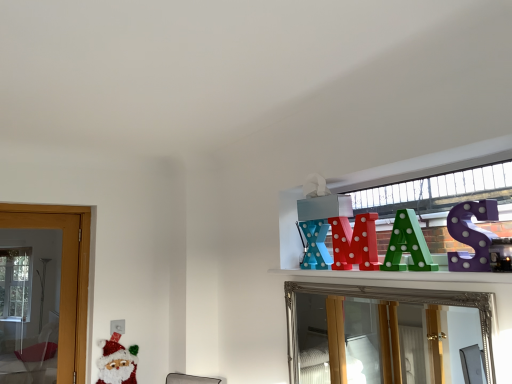
At what (x,y) coordinates should I click in order to perform the action: click on matte plastic letter x at upper center, which is counted as the 4th toy, starting from the front. Please return your answer as a coordinate pair (x, y). The image size is (512, 384). Looking at the image, I should click on (315, 245).

What is the approximate width of green polka dot letter a at upper center, which ranks as the third toy in left-to-right order?

green polka dot letter a at upper center, which ranks as the third toy in left-to-right order, is 2.84 inches in width.

Find the location of a particular element. This screenshot has height=384, width=512. green polka dot letter a at upper center, which is the 3th toy in back-to-front order is located at coordinates (407, 245).

Where is `shiny red letter at upper center, arranged as the 3th toy when viewed from the front`? shiny red letter at upper center, arranged as the 3th toy when viewed from the front is located at coordinates (355, 242).

From the image's perspective, which is above, matte plastic letter x at upper center, which is counted as the 4th toy, starting from the front, or shiny red letter at upper center, which is the 2th toy from back to front?

shiny red letter at upper center, which is the 2th toy from back to front, is shown above in the image.

Which is closer, (316, 226) or (351, 230)?

Point (316, 226) appears to be farther away from the viewer than point (351, 230).

Which of these two, matte plastic letter x at upper center, which is counted as the 4th toy, starting from the front, or shiny red letter at upper center, which is the 2th toy from back to front, is smaller?

Smaller between the two is matte plastic letter x at upper center, which is counted as the 4th toy, starting from the front.

Is matte plastic letter x at upper center, marked as the 1th toy in a left-to-right arrangement, to the left or to the right of shiny red letter at upper center, which is the 2th toy from back to front, in the image?

Clearly, matte plastic letter x at upper center, marked as the 1th toy in a left-to-right arrangement, is on the left of shiny red letter at upper center, which is the 2th toy from back to front, in the image.

How different are the orientations of purple polka dot letter at upper right, which appears as the 1th toy when viewed from the front, and green polka dot letter a at upper center, which ranks as the third toy in left-to-right order, in degrees?

They differ by 3.57 degrees in their facing directions.

From the image's perspective, which is above, purple polka dot letter at upper right, which appears as the 1th toy when viewed from the front, or green polka dot letter a at upper center, which ranks as the third toy in left-to-right order?

purple polka dot letter at upper right, which appears as the 1th toy when viewed from the front, appears higher in the image.

Is purple polka dot letter at upper right, arranged as the 4th toy when viewed from the back, positioned with its back to green polka dot letter a at upper center, which is the 3th toy in back-to-front order?

No, purple polka dot letter at upper right, arranged as the 4th toy when viewed from the back, is not facing away from green polka dot letter a at upper center, which is the 3th toy in back-to-front order.

Would you say purple polka dot letter at upper right, the first toy from the right, is outside green polka dot letter a at upper center, which is the 3th toy in back-to-front order?

Yes.

Are green polka dot letter a at upper center, arranged as the second toy when viewed from the right, and silver/glass mirror at upper center making contact?

→ No.

Is green polka dot letter a at upper center, arranged as the second toy when viewed from the right, spatially inside silver/glass mirror at upper center, or outside of it?

The correct answer is: outside.

Is green polka dot letter a at upper center, which is the 3th toy in back-to-front order, facing away from silver/glass mirror at upper center?

No.

From the image's perspective, which one is positioned lower, green polka dot letter a at upper center, arranged as the second toy when viewed from the right, or silver/glass mirror at upper center?

From the image's view, silver/glass mirror at upper center is below.

Does shiny red letter at upper center, arranged as the third toy when viewed from the right, have a smaller size compared to silver/glass mirror at upper center?

Indeed, shiny red letter at upper center, arranged as the third toy when viewed from the right, has a smaller size compared to silver/glass mirror at upper center.

Are shiny red letter at upper center, arranged as the third toy when viewed from the right, and silver/glass mirror at upper center beside each other?

shiny red letter at upper center, arranged as the third toy when viewed from the right, and silver/glass mirror at upper center are clearly separated.

Considering the relative sizes of green polka dot letter a at upper center, the 2th toy when ordered from front to back, and felt santa claus at lower left in the image provided, is green polka dot letter a at upper center, the 2th toy when ordered from front to back, taller than felt santa claus at lower left?

Incorrect, the height of green polka dot letter a at upper center, the 2th toy when ordered from front to back, is not larger of that of felt santa claus at lower left.

Who is bigger, green polka dot letter a at upper center, which is the 3th toy in back-to-front order, or felt santa claus at lower left?

felt santa claus at lower left.

Where is `santa claus on the left of green polka dot letter a at upper center, which ranks as the third toy in left-to-right order`? The width and height of the screenshot is (512, 384). santa claus on the left of green polka dot letter a at upper center, which ranks as the third toy in left-to-right order is located at coordinates (117, 362).

Is point (406, 209) behind point (128, 355)?

That is False.

Where is `the 4th toy located above the felt santa claus at lower left (from a real-world perspective)`? This screenshot has height=384, width=512. the 4th toy located above the felt santa claus at lower left (from a real-world perspective) is located at coordinates (315, 245).

Could you tell me if matte plastic letter x at upper center, which ranks as the 4th toy in right-to-left order, is turned towards felt santa claus at lower left?

No, matte plastic letter x at upper center, which ranks as the 4th toy in right-to-left order, is not oriented towards felt santa claus at lower left.

What's the angular difference between matte plastic letter x at upper center, which is counted as the 4th toy, starting from the front, and felt santa claus at lower left's facing directions?

There is a 90.8-degree angle between the facing directions of matte plastic letter x at upper center, which is counted as the 4th toy, starting from the front, and felt santa claus at lower left.

Consider the image. From a real-world perspective, which is physically above, felt santa claus at lower left or green polka dot letter a at upper center, arranged as the second toy when viewed from the right?

From a 3D spatial view, green polka dot letter a at upper center, arranged as the second toy when viewed from the right, is above.

At what (x,y) coordinates should I click in order to perform the action: click on the 3rd toy counting from the right side of the felt santa claus at lower left. Please return your answer as a coordinate pair (x, y). Image resolution: width=512 pixels, height=384 pixels. Looking at the image, I should click on (x=407, y=245).

Is felt santa claus at lower left completely or partially outside of green polka dot letter a at upper center, which ranks as the third toy in left-to-right order?

Yes.

Identify the location of the 1st toy positioned above the matte plastic letter x at upper center, which is the first toy in back-to-front order (from the image's perspective). (355, 242).

From the purple polka dot letter at upper right, which appears as the 1th toy when viewed from the front, count 1st toys backward and point to it. Please provide its 2D coordinates.

[(407, 245)]

Considering their positions, is felt santa claus at lower left positioned further to green polka dot letter a at upper center, arranged as the second toy when viewed from the right, than matte plastic letter x at upper center, which ranks as the 4th toy in right-to-left order?

felt santa claus at lower left is positioned further to the anchor green polka dot letter a at upper center, arranged as the second toy when viewed from the right.

Looking at the image, which one is located closer to purple polka dot letter at upper right, which appears as the 1th toy when viewed from the front, matte plastic letter x at upper center, which is the first toy in back-to-front order, or silver/glass mirror at upper center?

silver/glass mirror at upper center is positioned closer to the anchor purple polka dot letter at upper right, which appears as the 1th toy when viewed from the front.

When comparing their distances from green polka dot letter a at upper center, which ranks as the third toy in left-to-right order, does shiny red letter at upper center, which is the 2th toy from back to front, or purple polka dot letter at upper right, the first toy from the right, seem further?

The object further to green polka dot letter a at upper center, which ranks as the third toy in left-to-right order, is purple polka dot letter at upper right, the first toy from the right.

When comparing their distances from matte plastic letter x at upper center, which is the first toy in back-to-front order, does shiny red letter at upper center, arranged as the third toy when viewed from the right, or silver/glass mirror at upper center seem further?

silver/glass mirror at upper center is further to matte plastic letter x at upper center, which is the first toy in back-to-front order.

Which object lies nearer to the anchor point silver/glass mirror at upper center, green polka dot letter a at upper center, the 2th toy when ordered from front to back, or matte plastic letter x at upper center, marked as the 1th toy in a left-to-right arrangement?

green polka dot letter a at upper center, the 2th toy when ordered from front to back, is closer to silver/glass mirror at upper center.

Looking at this image, when comparing their distances from silver/glass mirror at upper center, does shiny red letter at upper center, arranged as the 3th toy when viewed from the front, or felt santa claus at lower left seem closer?

shiny red letter at upper center, arranged as the 3th toy when viewed from the front, is positioned closer to the anchor silver/glass mirror at upper center.

Looking at the image, which one is located closer to silver/glass mirror at upper center, shiny red letter at upper center, which is counted as the second toy, starting from the left, or matte plastic letter x at upper center, which is counted as the 4th toy, starting from the front?

shiny red letter at upper center, which is counted as the second toy, starting from the left, lies closer to silver/glass mirror at upper center than the other object.

Considering their positions, is silver/glass mirror at upper center positioned closer to shiny red letter at upper center, which is the 2th toy from back to front, than felt santa claus at lower left?

silver/glass mirror at upper center is closer to shiny red letter at upper center, which is the 2th toy from back to front.

This screenshot has width=512, height=384. Find the location of `mirror between felt santa claus at lower left and purple polka dot letter at upper right, arranged as the 4th toy when viewed from the back, from left to right`. mirror between felt santa claus at lower left and purple polka dot letter at upper right, arranged as the 4th toy when viewed from the back, from left to right is located at coordinates (389, 300).

Where is `toy between purple polka dot letter at upper right, arranged as the 4th toy when viewed from the back, and shiny red letter at upper center, arranged as the third toy when viewed from the right, from front to back`? toy between purple polka dot letter at upper right, arranged as the 4th toy when viewed from the back, and shiny red letter at upper center, arranged as the third toy when viewed from the right, from front to back is located at coordinates (407, 245).

Locate an element on the screen. The image size is (512, 384). toy between felt santa claus at lower left and shiny red letter at upper center, which is the 2th toy from back to front is located at coordinates (315, 245).

This screenshot has height=384, width=512. In order to click on mirror between felt santa claus at lower left and green polka dot letter a at upper center, arranged as the second toy when viewed from the right, in the horizontal direction in this screenshot , I will do `click(389, 300)`.